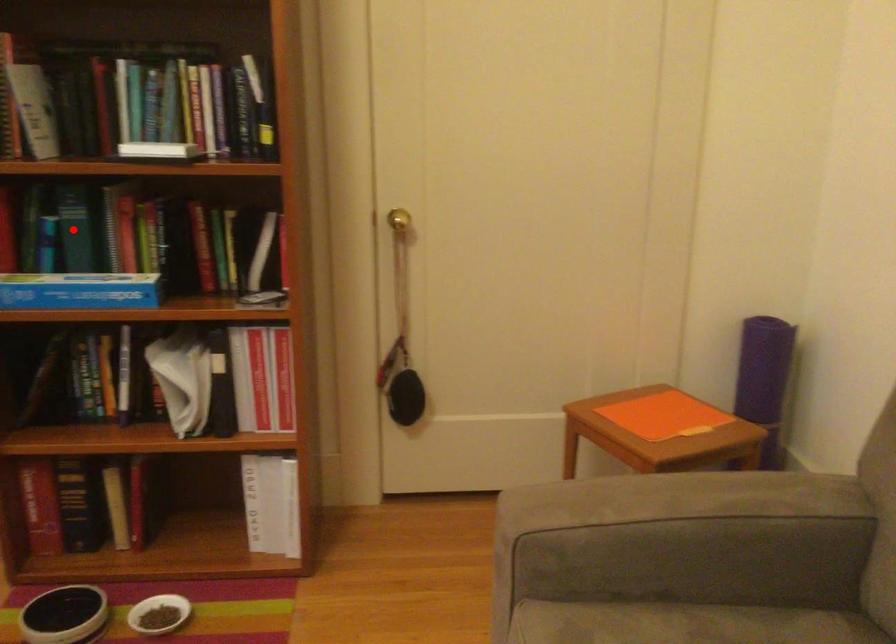
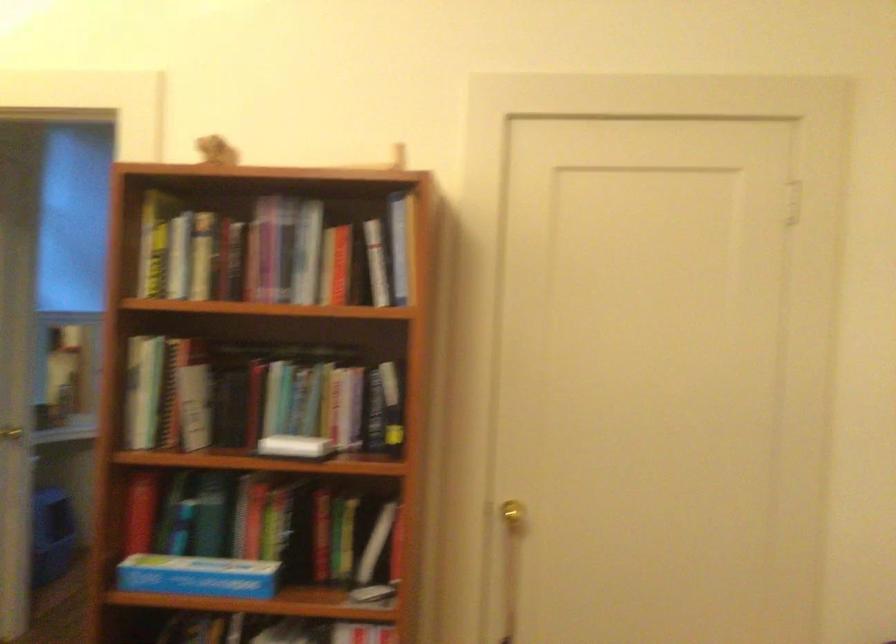
Where in the second image is the point corresponding to the highlighted location from the first image?

(208, 514)